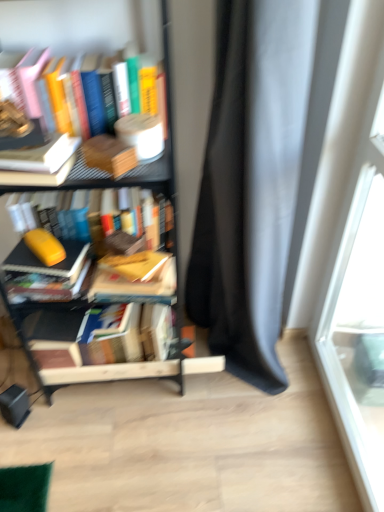
Question: From a real-world perspective, does matte yellow book at left, the 2th book from the bottom, sit lower than orange matte book at center, which appears as the fourth book when ordered from the bottom?

Choices:
 (A) no
 (B) yes

Answer: (B)

Question: Is matte yellow book at left, the 2th book from the bottom, thinner than orange matte book at center, which appears as the fourth book when ordered from the bottom?

Choices:
 (A) yes
 (B) no

Answer: (A)

Question: Is the surface of matte yellow book at left, which appears as the 5th book when viewed from the top, in direct contact with orange matte book at center, which is counted as the 3th book, starting from the top?

Choices:
 (A) yes
 (B) no

Answer: (B)

Question: Is matte yellow book at left, the 2th book from the bottom, positioned behind orange matte book at center, which is counted as the 3th book, starting from the top?

Choices:
 (A) no
 (B) yes

Answer: (A)

Question: Does matte yellow book at left, which appears as the 5th book when viewed from the top, have a smaller size compared to orange matte book at center, which is counted as the 3th book, starting from the top?

Choices:
 (A) no
 (B) yes

Answer: (B)

Question: From the image's perspective, is wooden at left, the 2th paperback book in the back-to-front sequence, located above or below white matte book at upper left, the 2th book positioned from the top?

Choices:
 (A) below
 (B) above

Answer: (B)

Question: From a real-world perspective, is wooden at left, marked as the first paperback book in a top-to-bottom arrangement, positioned above or below white matte book at upper left, the 2th book positioned from the top?

Choices:
 (A) above
 (B) below

Answer: (B)

Question: In terms of width, does wooden at left, marked as the 1th paperback book in a front-to-back arrangement, look wider or thinner when compared to white matte book at upper left, arranged as the fifth book when ordered from the bottom?

Choices:
 (A) thin
 (B) wide

Answer: (A)

Question: Is wooden at left, marked as the 1th paperback book in a front-to-back arrangement, situated inside white matte book at upper left, arranged as the fifth book when ordered from the bottom, or outside?

Choices:
 (A) inside
 (B) outside

Answer: (B)

Question: Is matte yellow book at left, which appears as the 5th book when viewed from the top, taller or shorter than hardcover book at center, the sixth book viewed from the top?

Choices:
 (A) short
 (B) tall

Answer: (A)

Question: Which is correct: matte yellow book at left, the 2th book from the bottom, is inside hardcover book at center, which is counted as the 1th book, starting from the bottom, or outside of it?

Choices:
 (A) inside
 (B) outside

Answer: (B)

Question: Would you say matte yellow book at left, which appears as the 5th book when viewed from the top, is to the left or to the right of hardcover book at center, the sixth book viewed from the top, in the picture?

Choices:
 (A) left
 (B) right

Answer: (A)

Question: In terms of size, does matte yellow book at left, the 2th book from the bottom, appear bigger or smaller than hardcover book at center, which is counted as the 1th book, starting from the bottom?

Choices:
 (A) small
 (B) big

Answer: (A)

Question: In terms of height, does white matte book at upper left, arranged as the fifth book when ordered from the bottom, look taller or shorter compared to yellow matte book at left, marked as the 2th paperback book in a top-to-bottom arrangement?

Choices:
 (A) short
 (B) tall

Answer: (B)

Question: Based on their sizes in the image, would you say white matte book at upper left, the 2th book positioned from the top, is bigger or smaller than yellow matte book at left, which is the 2th paperback book in right-to-left order?

Choices:
 (A) small
 (B) big

Answer: (B)